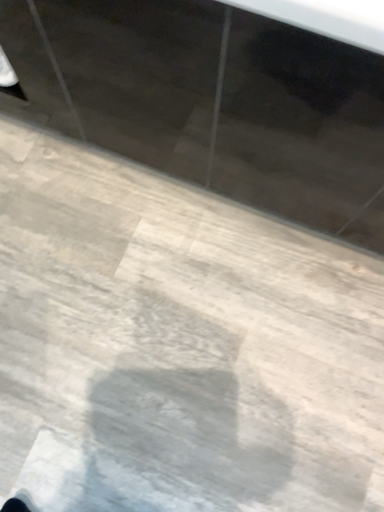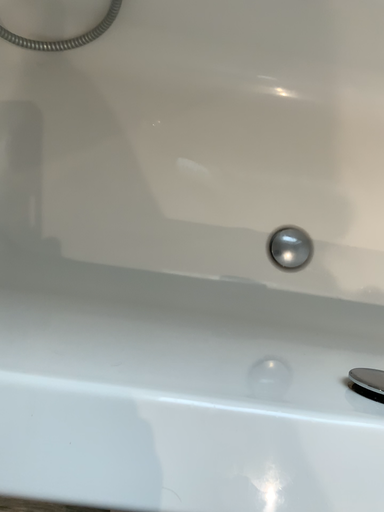
Question: Which way did the camera rotate in the video?

Choices:
 (A) rotated right
 (B) rotated left

Answer: (A)